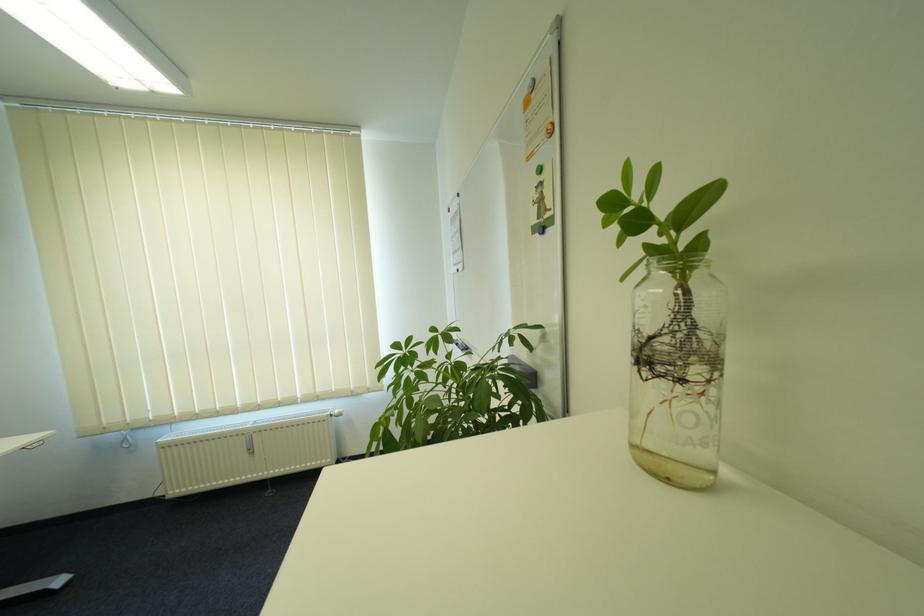
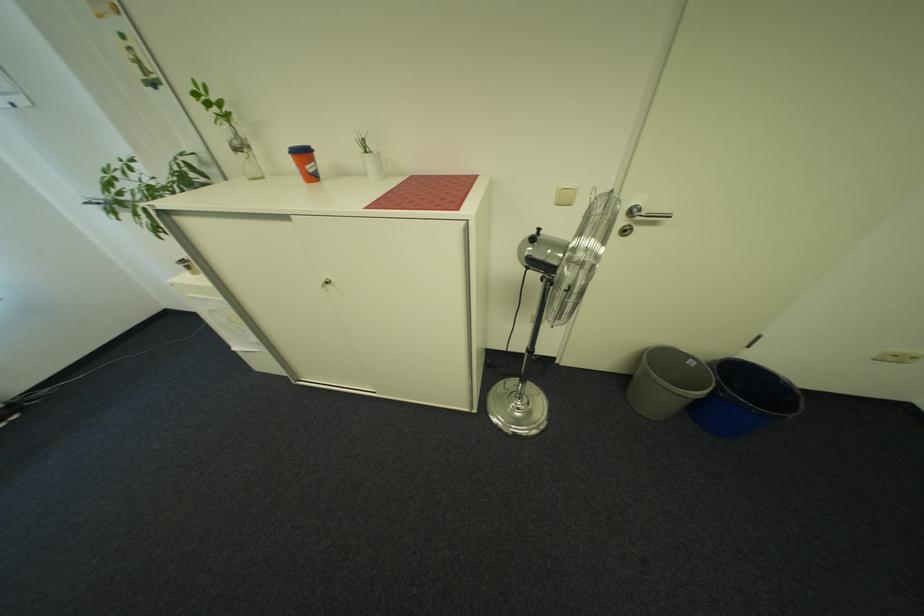
Locate, in the second image, the point that corresponds to [690,381] in the first image.

(252, 153)